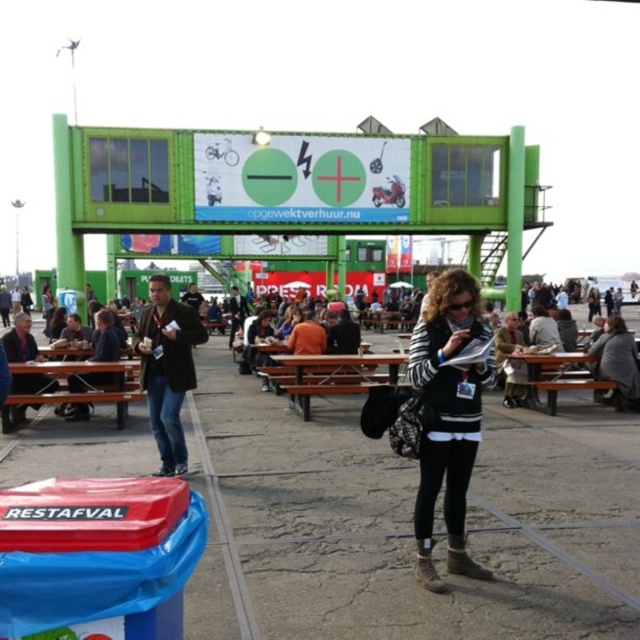
Question: Which object is closer to the camera taking this photo?

Choices:
 (A) brown wooden picnic table at lower left
 (B) brown wooden picnic table at lower right

Answer: (A)

Question: Which is nearer to the brown wooden bench at center?

Choices:
 (A) dark brown leather jacket at center
 (B) brown wooden picnic table at lower right

Answer: (B)

Question: Which point is farther to the camera?

Choices:
 (A) brown wooden picnic table at lower left
 (B) black textured jacket at center
 (C) brown wooden picnic table at lower right
 (D) dark brown leather jacket at center

Answer: (C)

Question: Is dark brown leather jacket at center further to camera compared to brown wooden picnic table at lower left?

Choices:
 (A) yes
 (B) no

Answer: (B)

Question: Is black textured jacket at center to the left of dark brown leather jacket at center from the viewer's perspective?

Choices:
 (A) yes
 (B) no

Answer: (B)

Question: Considering the relative positions of black textured jacket at center and brown wooden picnic table at lower left in the image provided, where is black textured jacket at center located with respect to brown wooden picnic table at lower left?

Choices:
 (A) below
 (B) above

Answer: (B)